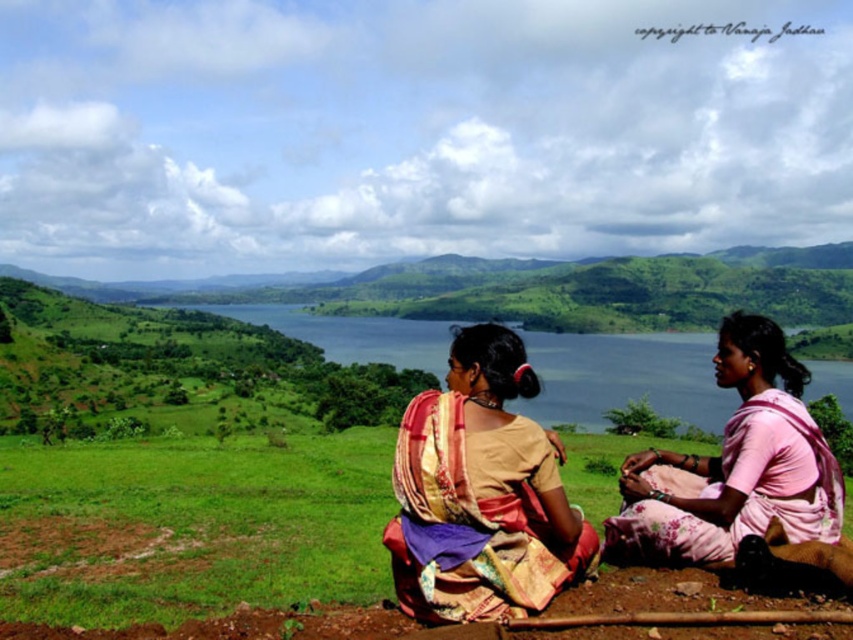
Question: Considering the real-world distances, which object is farthest from the multicolored silk saree at center?

Choices:
 (A) blue water at center
 (B) pink satin saree at lower right

Answer: (A)

Question: Is the position of pink satin saree at lower right less distant than that of blue water at center?

Choices:
 (A) no
 (B) yes

Answer: (B)

Question: Does multicolored silk saree at center appear over pink satin saree at lower right?

Choices:
 (A) yes
 (B) no

Answer: (B)

Question: Which point is closer to the camera?

Choices:
 (A) (564, 554)
 (B) (836, 515)

Answer: (A)

Question: Does multicolored silk saree at center appear on the left side of pink satin saree at lower right?

Choices:
 (A) yes
 (B) no

Answer: (A)

Question: Among these objects, which one is farthest from the camera?

Choices:
 (A) multicolored silk saree at center
 (B) pink satin saree at lower right

Answer: (B)